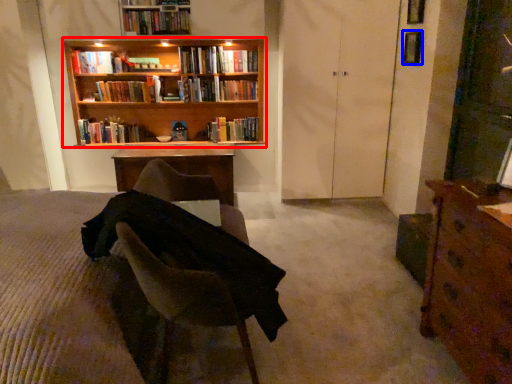
Question: Which object is closer to the camera taking this photo, bookcase (highlighted by a red box) or window (highlighted by a blue box)?

Choices:
 (A) bookcase
 (B) window

Answer: (B)